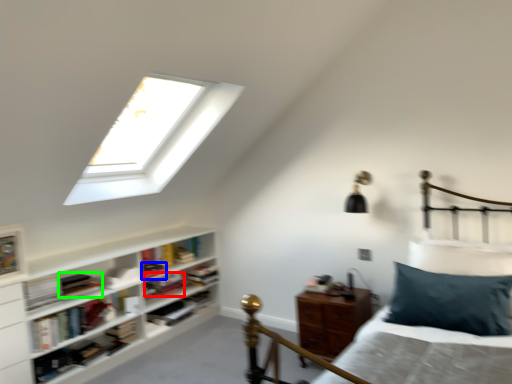
Question: Estimate the real-world distances between objects in this image. Which object is closer to book (highlighted by a red box), book (highlighted by a blue box) or book (highlighted by a green box)?

Choices:
 (A) book
 (B) book

Answer: (A)